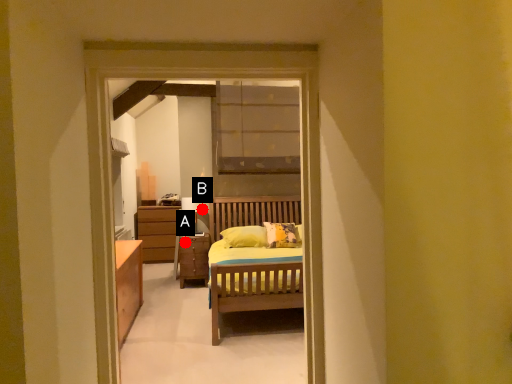
Question: Two points are circled on the image, labeled by A and B beside each circle. Which point appears farthest from the camera in this image?

Choices:
 (A) A is further
 (B) B is further

Answer: (A)